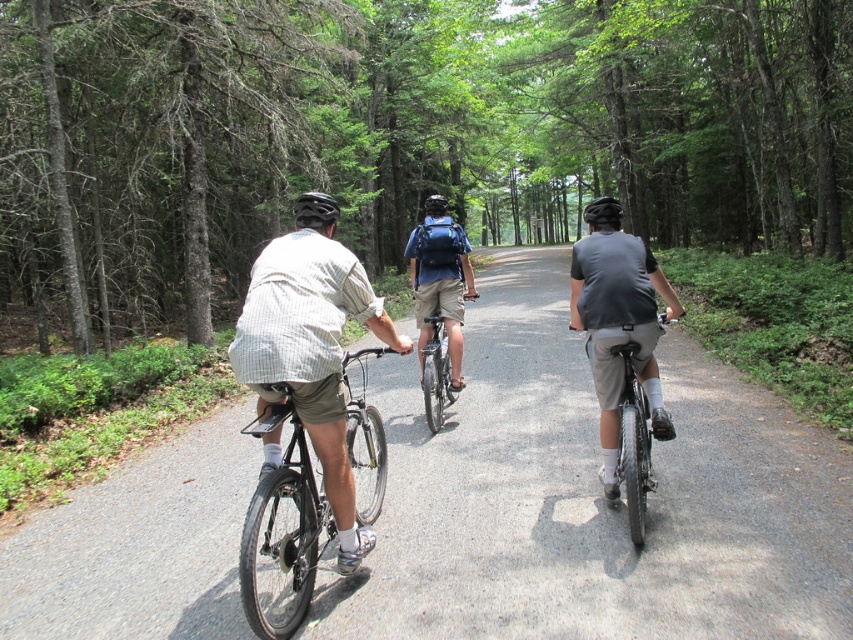
Question: Based on their relative distances, which object is nearer to the matte black bicycle at center?

Choices:
 (A) gray asphalt road at center
 (B) shiny metallic bicycle at center
 (C) blue backpack at center
 (D) green matte forest at center

Answer: (C)

Question: Which point is farther from the camera taking this photo?

Choices:
 (A) (442, 385)
 (B) (610, 435)
 (C) (712, 582)

Answer: (A)

Question: Which point is closer to the camera taking this photo?

Choices:
 (A) (424, 282)
 (B) (151, 556)
 (C) (426, 204)
 (D) (428, 356)

Answer: (B)

Question: Can you confirm if shiny metallic bicycle at center is positioned below matte black helmet at center?

Choices:
 (A) yes
 (B) no

Answer: (A)

Question: Is green matte forest at center closer to the viewer compared to matte black bicycle at center?

Choices:
 (A) no
 (B) yes

Answer: (A)

Question: Does gray matte shirt at center come behind blue backpack at center?

Choices:
 (A) yes
 (B) no

Answer: (B)